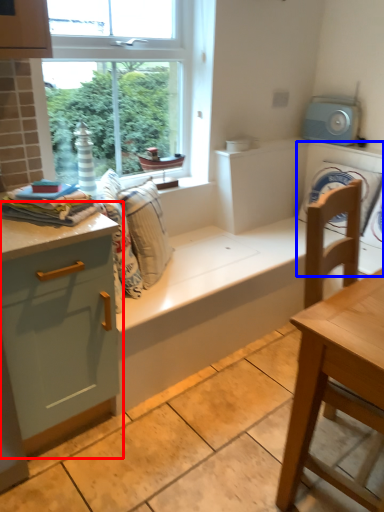
Question: Which object appears closest to the camera in this image, dresser (highlighted by a red box) or washing machine (highlighted by a blue box)?

Choices:
 (A) dresser
 (B) washing machine

Answer: (A)